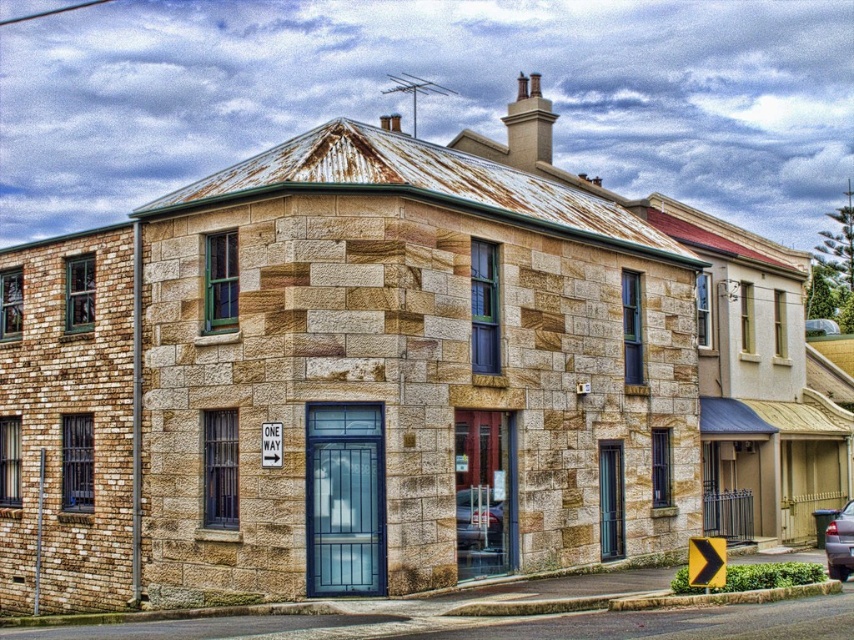
You are standing in front of the two story stone building. You see a metallic silver car at center. Where is the point at location (478, 518) in relation to the metallic silver car at center?

The point at (478, 518) is on the metallic silver car at center.

You are standing in front of the two story stone building and want to walk from point A to point B. Point A is at coordinate point (x=469, y=502) and point B is at coordinate point (x=835, y=572). According to the image, which point is closer to you, point A or point B?

Point A is closer to you because it is in front of point B according to the image description.

You are a delivery person trying to park your delivery van, which is 2 meters wide, in front of the building. There is a metallic silver car at center and a metallic silver sedan at lower right parked nearby. Can you determine if there is enough space between them to park your van?

The metallic silver car at center is narrower than the metallic silver sedan at lower right, but without knowing the exact distance between them, it is impossible to determine if there is enough space for the van.